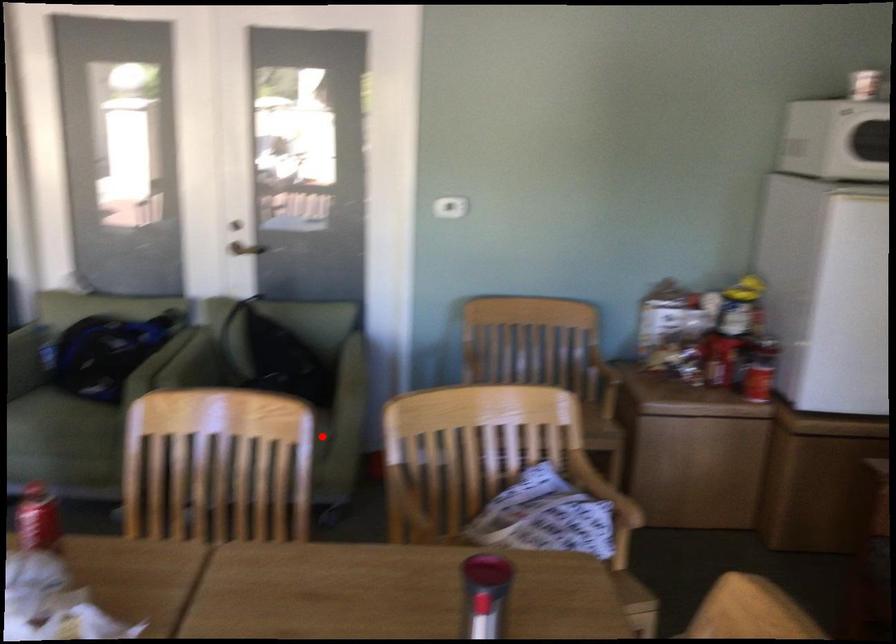
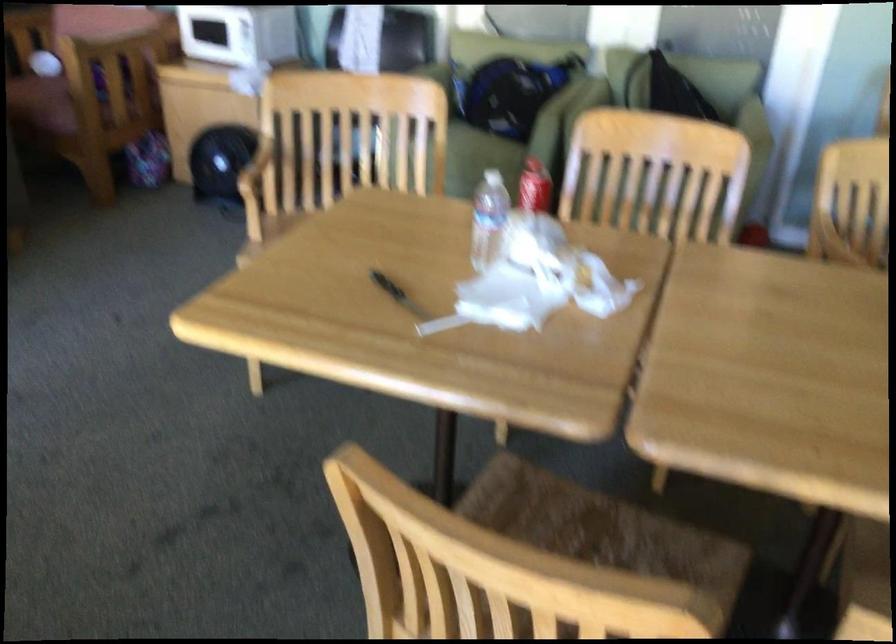
Question: I am providing you with two images of the same scene from different viewpoints. A red point is marked on the first image. At the location where the point appears in image 1, is it still visible in image 2?

Choices:
 (A) Yes
 (B) No

Answer: (B)